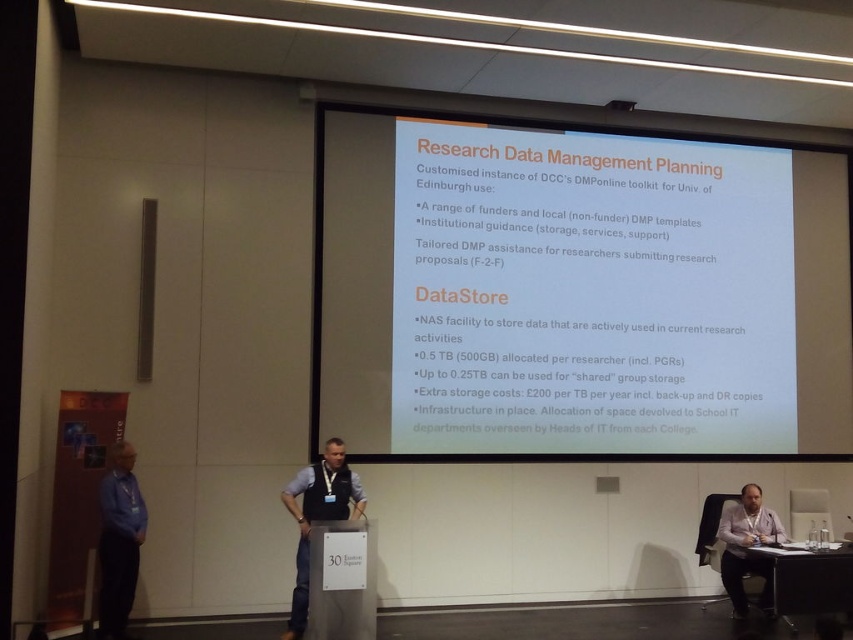
You are a researcher preparing for a presentation in the conference room. You have a white paper at center and a black plastic table at lower right. Where should you place your notes so they are easily accessible during your talk?

The white paper at center is located above the black plastic table at lower right. To keep notes easily accessible, place them on the black plastic table at lower right since it is lower and within reach during the presentation.

From the picture: You are a researcher preparing for a presentation and need to place both the white paper at center and the black plastic table at lower right on your desk. Considering their sizes, which object would require more vertical space?

The white paper at center requires more vertical space because it has a greater height compared to the black plastic table at lower right.